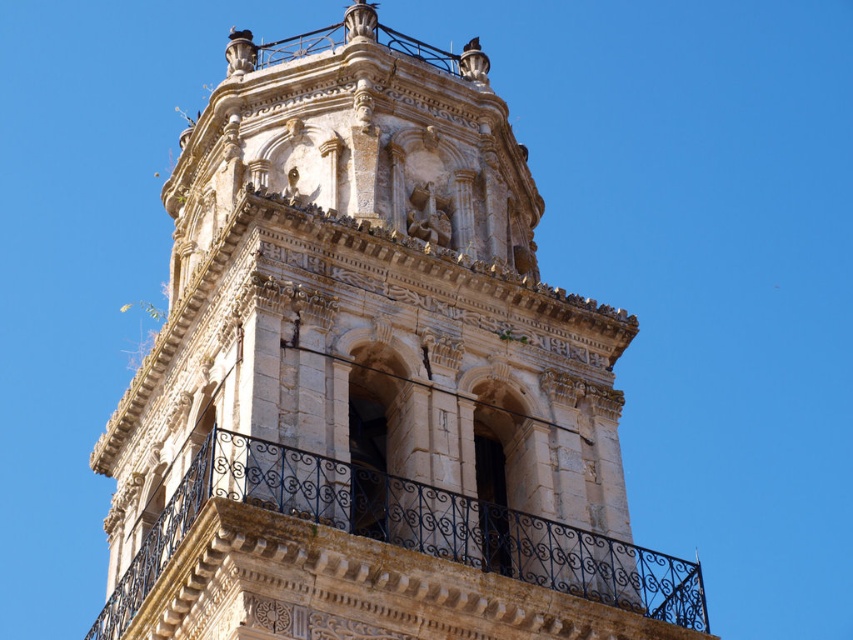
Question: Is white stone tower at center wider than black wrought iron balcony at center?

Choices:
 (A) no
 (B) yes

Answer: (B)

Question: Which point is closer to the camera?

Choices:
 (A) (566, 476)
 (B) (148, 547)

Answer: (B)

Question: In this image, where is white stone tower at center located relative to black wrought iron balcony at center?

Choices:
 (A) left
 (B) right

Answer: (A)

Question: Where is white stone tower at center located in relation to black wrought iron balcony at center in the image?

Choices:
 (A) right
 (B) left

Answer: (B)